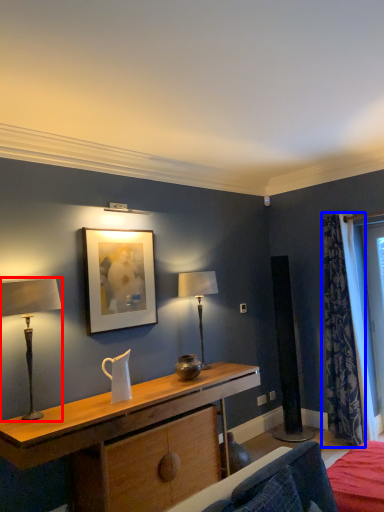
Question: Which object appears closest to the camera in this image, table lamp (highlighted by a red box) or curtain (highlighted by a blue box)?

Choices:
 (A) table lamp
 (B) curtain

Answer: (A)